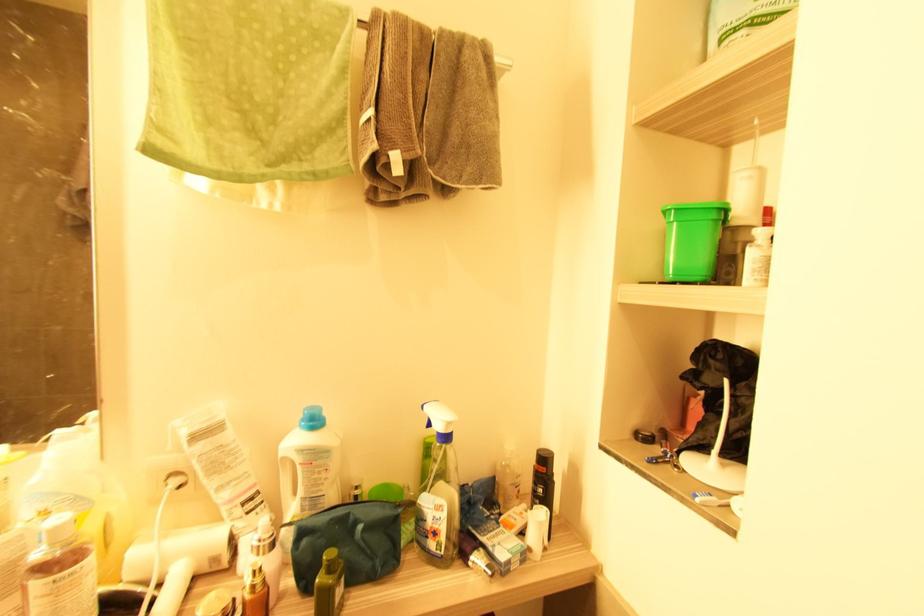
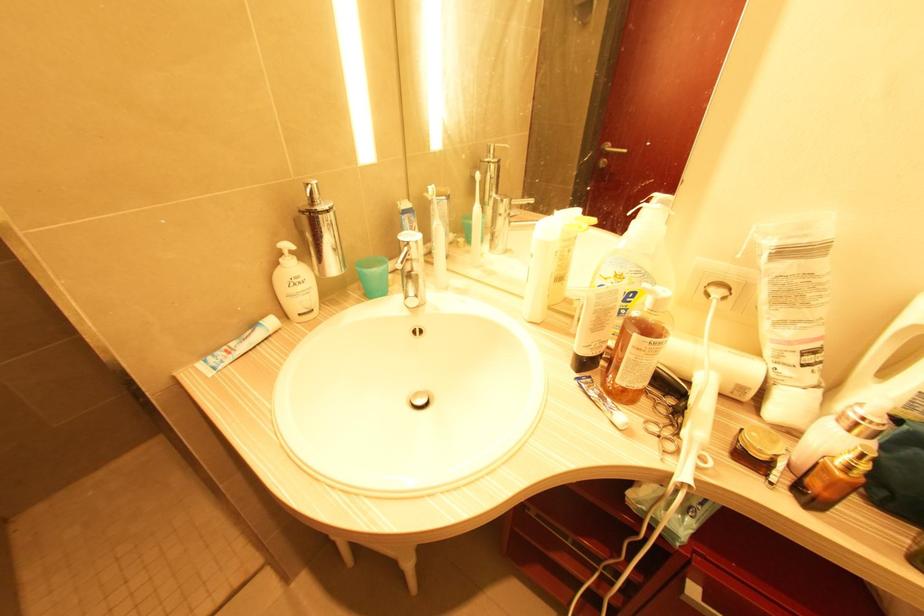
The point at [43,514] is marked in the first image. Where is the corresponding point in the second image?

(617, 276)